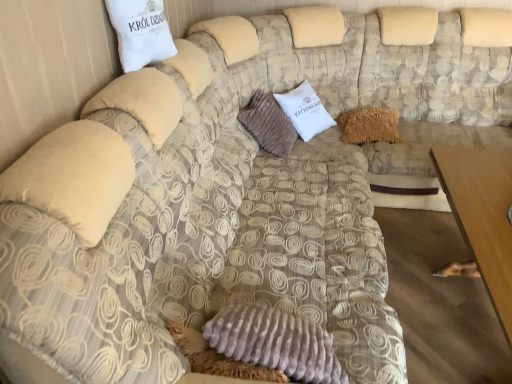
What is the approximate width of fuzzy brown pillow at center, arranged as the second pillow when viewed from the left?

14.18 inches.

This screenshot has height=384, width=512. What are the coordinates of `fuzzy brown pillow at center, the second pillow when ordered from front to back` in the screenshot? It's located at (268, 124).

Is white cotton pillow at upper left, the first pillow when ordered from left to right, inside or outside of brown wooden table at lower right?

white cotton pillow at upper left, the first pillow when ordered from left to right, is not inside brown wooden table at lower right, it's outside.

Is white cotton pillow at upper left, arranged as the 3th pillow when viewed from the right, facing away from brown wooden table at lower right?

No.

Considering the positions of objects white cotton pillow at upper left, which appears as the third pillow when viewed from the back, and brown wooden table at lower right in the image provided, who is more to the left, white cotton pillow at upper left, which appears as the third pillow when viewed from the back, or brown wooden table at lower right?

Positioned to the left is white cotton pillow at upper left, which appears as the third pillow when viewed from the back.

Is fuzzy brown pillow at center, the 3th pillow when ordered from front to back, to the left of white cotton pillow at upper left, which appears as the third pillow when viewed from the back, from the viewer's perspective?

No, fuzzy brown pillow at center, the 3th pillow when ordered from front to back, is not to the left of white cotton pillow at upper left, which appears as the third pillow when viewed from the back.

From the image's perspective, between fuzzy brown pillow at center, the third pillow in the left-to-right sequence, and white cotton pillow at upper left, the first pillow when ordered from left to right, who is located below?

fuzzy brown pillow at center, the third pillow in the left-to-right sequence, is shown below in the image.

Are fuzzy brown pillow at center, the 3th pillow when ordered from front to back, and white cotton pillow at upper left, arranged as the 3th pillow when viewed from the right, beside each other?

No, fuzzy brown pillow at center, the 3th pillow when ordered from front to back, is not beside white cotton pillow at upper left, arranged as the 3th pillow when viewed from the right.

What's the angular difference between fuzzy brown pillow at center, which appears as the 1th pillow when viewed from the back, and white cotton pillow at upper left, arranged as the 3th pillow when viewed from the right,'s facing directions?

74.1 degrees.

Which object is positioned more to the right, brown wooden table at lower right or white cotton pillow at upper left, which appears as the third pillow when viewed from the back?

brown wooden table at lower right is more to the right.

Can you tell me how much brown wooden table at lower right and white cotton pillow at upper left, arranged as the 3th pillow when viewed from the right, differ in facing direction?

They differ by 13 degrees in their facing directions.

Is brown wooden table at lower right taller or shorter than white cotton pillow at upper left, which appears as the third pillow when viewed from the back?

brown wooden table at lower right is taller than white cotton pillow at upper left, which appears as the third pillow when viewed from the back.

Who is bigger, brown wooden table at lower right or white cotton pillow at upper left, arranged as the 3th pillow when viewed from the right?

brown wooden table at lower right.

Is white cotton pillow at upper left, which appears as the third pillow when viewed from the back, bigger than fuzzy brown pillow at center, the second pillow in the back-to-front sequence?

Incorrect, white cotton pillow at upper left, which appears as the third pillow when viewed from the back, is not larger than fuzzy brown pillow at center, the second pillow in the back-to-front sequence.

Which is farther, (145, 32) or (284, 146)?

Point (284, 146)

Could you tell me if white cotton pillow at upper left, the first pillow when ordered from left to right, is facing fuzzy brown pillow at center, arranged as the second pillow when viewed from the left?

No, white cotton pillow at upper left, the first pillow when ordered from left to right, is not aimed at fuzzy brown pillow at center, arranged as the second pillow when viewed from the left.

The image size is (512, 384). I want to click on the 1st pillow to the right when counting from the white cotton pillow at upper left, which appears as the third pillow when viewed from the back, so click(268, 124).

Is white cotton pillow at upper left, the first pillow when ordered from left to right, located outside fuzzy brown pillow at center, which appears as the 1th pillow when viewed from the back?

Yes, white cotton pillow at upper left, the first pillow when ordered from left to right, is not within fuzzy brown pillow at center, which appears as the 1th pillow when viewed from the back.

Is white cotton pillow at upper left, arranged as the 3th pillow when viewed from the right, far away from fuzzy brown pillow at center, placed as the 1th pillow when sorted from right to left?

white cotton pillow at upper left, arranged as the 3th pillow when viewed from the right, is far away from fuzzy brown pillow at center, placed as the 1th pillow when sorted from right to left.

What are the coordinates of `the 2nd pillow behind when counting from the white cotton pillow at upper left, which appears as the third pillow when viewed from the back` in the screenshot? It's located at (369, 125).

Which object is more forward, white cotton pillow at upper left, arranged as the 3th pillow when viewed from the right, or fuzzy brown pillow at center, which appears as the 1th pillow when viewed from the back?

white cotton pillow at upper left, arranged as the 3th pillow when viewed from the right, is closer to the camera.

Is fuzzy brown pillow at center, which appears as the 1th pillow when viewed from the back, oriented away from brown wooden table at lower right?

No, fuzzy brown pillow at center, which appears as the 1th pillow when viewed from the back, is not facing away from brown wooden table at lower right.

Between fuzzy brown pillow at center, which appears as the 1th pillow when viewed from the back, and brown wooden table at lower right, which one appears on the left side from the viewer's perspective?

fuzzy brown pillow at center, which appears as the 1th pillow when viewed from the back, is more to the left.

Is point (388, 130) less distant than point (496, 311)?

No, (388, 130) is further to viewer.

From a real-world perspective, is fuzzy brown pillow at center, which appears as the 1th pillow when viewed from the back, located beneath brown wooden table at lower right?

Incorrect, from a real-world perspective, fuzzy brown pillow at center, which appears as the 1th pillow when viewed from the back, is higher than brown wooden table at lower right.

Which is correct: brown wooden table at lower right is inside fuzzy brown pillow at center, the third pillow in the left-to-right sequence, or outside of it?

brown wooden table at lower right is outside fuzzy brown pillow at center, the third pillow in the left-to-right sequence.

Between brown wooden table at lower right and fuzzy brown pillow at center, the 3th pillow when ordered from front to back, which one has larger width?

brown wooden table at lower right.

Looking at this image, is brown wooden table at lower right further to the viewer compared to fuzzy brown pillow at center, placed as the 1th pillow when sorted from right to left?

No, the depth of brown wooden table at lower right is less than that of fuzzy brown pillow at center, placed as the 1th pillow when sorted from right to left.

Consider the image. Is brown wooden table at lower right aimed at fuzzy brown pillow at center, which appears as the 1th pillow when viewed from the back?

No, brown wooden table at lower right is not facing towards fuzzy brown pillow at center, which appears as the 1th pillow when viewed from the back.

Find the location of a particular element. This screenshot has width=512, height=384. the 3rd pillow located above the brown wooden table at lower right (from a real-world perspective) is located at coordinates (140, 32).

Where is `the 2nd pillow counting from the right side of the white cotton pillow at upper left, the first pillow from the front`? the 2nd pillow counting from the right side of the white cotton pillow at upper left, the first pillow from the front is located at coordinates (369, 125).

Looking at the image, which one is located closer to fuzzy brown pillow at center, the 3th pillow when ordered from front to back, fuzzy brown pillow at center, arranged as the second pillow when viewed from the left, or white cotton pillow at upper left, the first pillow when ordered from left to right?

The object closer to fuzzy brown pillow at center, the 3th pillow when ordered from front to back, is fuzzy brown pillow at center, arranged as the second pillow when viewed from the left.

Which object lies further to the anchor point fuzzy brown pillow at center, the 2th pillow from the right, fuzzy brown pillow at center, the 3th pillow when ordered from front to back, or brown wooden table at lower right?

brown wooden table at lower right.

When comparing their distances from brown wooden table at lower right, does fuzzy brown pillow at center, placed as the 1th pillow when sorted from right to left, or fuzzy brown pillow at center, arranged as the second pillow when viewed from the left, seem closer?

fuzzy brown pillow at center, placed as the 1th pillow when sorted from right to left, lies closer to brown wooden table at lower right than the other object.

From the picture: Estimate the real-world distances between objects in this image. Which object is closer to white cotton pillow at upper left, arranged as the 3th pillow when viewed from the right, fuzzy brown pillow at center, the 2th pillow from the right, or brown wooden table at lower right?

fuzzy brown pillow at center, the 2th pillow from the right, lies closer to white cotton pillow at upper left, arranged as the 3th pillow when viewed from the right, than the other object.

When comparing their distances from fuzzy brown pillow at center, which appears as the 1th pillow when viewed from the back, does white cotton pillow at upper left, the first pillow from the front, or brown wooden table at lower right seem closer?

brown wooden table at lower right.

When comparing their distances from fuzzy brown pillow at center, placed as the 1th pillow when sorted from right to left, does white cotton pillow at upper left, the first pillow from the front, or fuzzy brown pillow at center, the 2th pillow from the right, seem closer?

Based on the image, fuzzy brown pillow at center, the 2th pillow from the right, appears to be nearer to fuzzy brown pillow at center, placed as the 1th pillow when sorted from right to left.

Based on the photo, estimate the real-world distances between objects in this image. Which object is closer to brown wooden table at lower right, white cotton pillow at upper left, the first pillow from the front, or fuzzy brown pillow at center, the 3th pillow when ordered from front to back?

fuzzy brown pillow at center, the 3th pillow when ordered from front to back.

Looking at this image, based on their spatial positions, is fuzzy brown pillow at center, the second pillow when ordered from front to back, or fuzzy brown pillow at center, placed as the 1th pillow when sorted from right to left, closer to white cotton pillow at upper left, which appears as the third pillow when viewed from the back?

fuzzy brown pillow at center, the second pillow when ordered from front to back, is positioned closer to the anchor white cotton pillow at upper left, which appears as the third pillow when viewed from the back.

The height and width of the screenshot is (384, 512). Find the location of `pillow located between white cotton pillow at upper left, arranged as the 3th pillow when viewed from the right, and fuzzy brown pillow at center, which appears as the 1th pillow when viewed from the back, in the left-right direction`. pillow located between white cotton pillow at upper left, arranged as the 3th pillow when viewed from the right, and fuzzy brown pillow at center, which appears as the 1th pillow when viewed from the back, in the left-right direction is located at coordinates (268, 124).